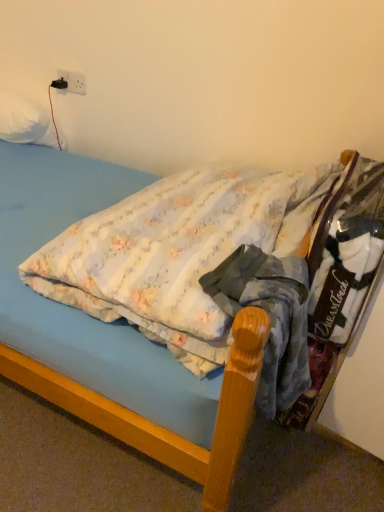
Question: Does fluffy cotton bed at center have a lesser height compared to white plastic electric outlet at upper left?

Choices:
 (A) yes
 (B) no

Answer: (B)

Question: Does fluffy cotton bed at center have a greater width compared to white plastic electric outlet at upper left?

Choices:
 (A) yes
 (B) no

Answer: (A)

Question: From a real-world perspective, is fluffy cotton bed at center positioned under white plastic electric outlet at upper left based on gravity?

Choices:
 (A) yes
 (B) no

Answer: (A)

Question: Can you confirm if fluffy cotton bed at center is taller than white plastic electric outlet at upper left?

Choices:
 (A) yes
 (B) no

Answer: (A)

Question: Is fluffy cotton bed at center outside white plastic electric outlet at upper left?

Choices:
 (A) no
 (B) yes

Answer: (B)

Question: Is white soft pillow at upper left to the left or to the right of white plastic electric outlet at upper left in the image?

Choices:
 (A) right
 (B) left

Answer: (B)

Question: Considering their positions, is white soft pillow at upper left located in front of or behind white plastic electric outlet at upper left?

Choices:
 (A) front
 (B) behind

Answer: (A)

Question: From the image's perspective, is white soft pillow at upper left located above or below white plastic electric outlet at upper left?

Choices:
 (A) below
 (B) above

Answer: (A)

Question: Considering the positions of white soft pillow at upper left and white plastic electric outlet at upper left in the image, is white soft pillow at upper left taller or shorter than white plastic electric outlet at upper left?

Choices:
 (A) short
 (B) tall

Answer: (B)

Question: Does point (289, 388) appear closer or farther from the camera than point (1, 334)?

Choices:
 (A) farther
 (B) closer

Answer: (B)

Question: Is blue cotton shirt at center taller or shorter than fluffy cotton bed at center?

Choices:
 (A) tall
 (B) short

Answer: (B)

Question: Would you say blue cotton shirt at center is inside or outside fluffy cotton bed at center?

Choices:
 (A) outside
 (B) inside

Answer: (B)

Question: Relative to fluffy cotton bed at center, is blue cotton shirt at center in front or behind?

Choices:
 (A) front
 (B) behind

Answer: (B)

Question: From a real-world perspective, is white plastic electric outlet at upper left positioned above or below white soft pillow at upper left?

Choices:
 (A) below
 (B) above

Answer: (B)

Question: Is point (67, 72) positioned closer to the camera than point (1, 102)?

Choices:
 (A) farther
 (B) closer

Answer: (B)